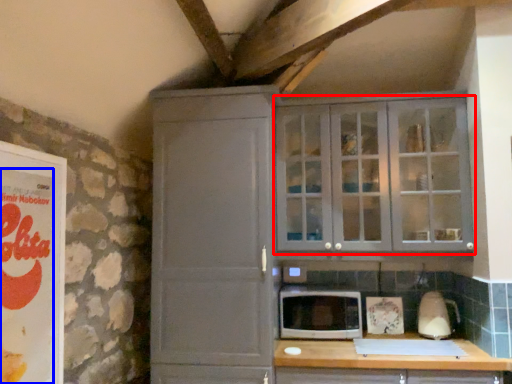
Question: Which point is further to the camera, cupboard (highlighted by a red box) or advertisement (highlighted by a blue box)?

Choices:
 (A) cupboard
 (B) advertisement

Answer: (A)